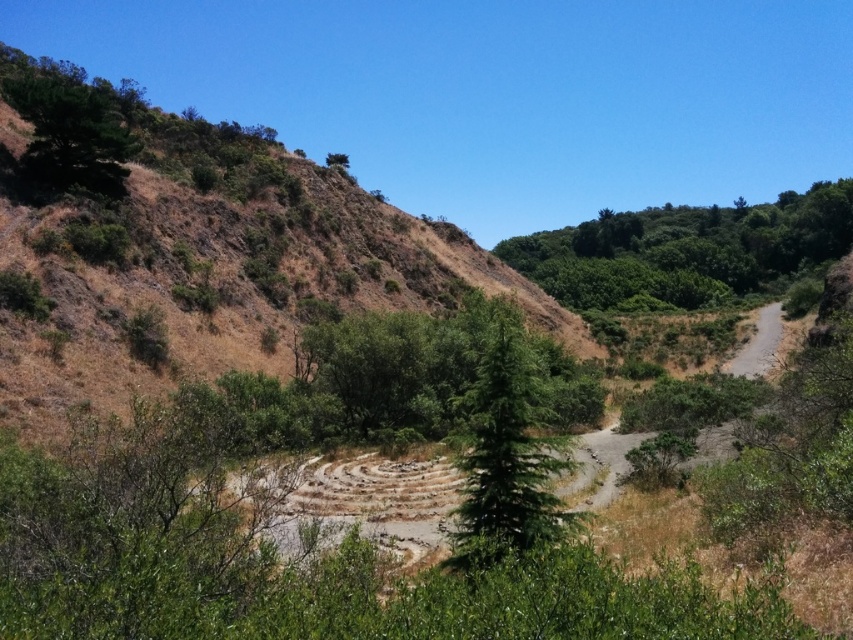
Who is taller, brown/dry grass at upper left or green leafy tree at upper left?

Standing taller between the two is brown/dry grass at upper left.

Which is behind, point (277, 241) or point (109, 108)?

Point (277, 241)

Where is `brown/dry grass at upper left`? This screenshot has height=640, width=853. brown/dry grass at upper left is located at coordinates (210, 260).

Can you confirm if green matte tree at center is positioned above green leafy tree at upper left?

Actually, green matte tree at center is below green leafy tree at upper left.

What are the coordinates of `green matte tree at center` in the screenshot? It's located at tap(506, 461).

Identify the location of green matte tree at center. The width and height of the screenshot is (853, 640). (506, 461).

What do you see at coordinates (210, 260) in the screenshot? I see `brown/dry grass at upper left` at bounding box center [210, 260].

Does brown/dry grass at upper left appear under green leafy tree at upper center?

Correct, brown/dry grass at upper left is located below green leafy tree at upper center.

Does point (120, 225) come farther from viewer compared to point (344, 156)?

No, (120, 225) is in front of (344, 156).

This screenshot has width=853, height=640. I want to click on brown/dry grass at upper left, so click(x=210, y=260).